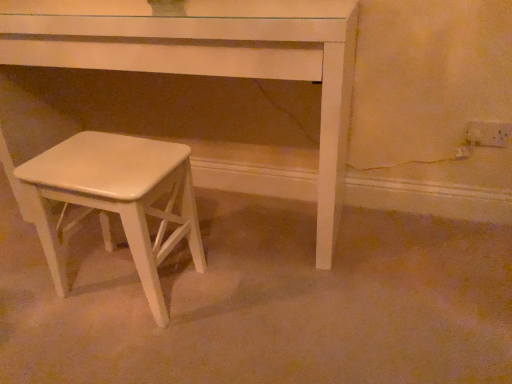
Question: In terms of height, does white wood stool at lower left look taller or shorter compared to white glossy stool at lower left?

Choices:
 (A) tall
 (B) short

Answer: (A)

Question: From a real-world perspective, is white wood stool at lower left physically located above or below white glossy stool at lower left?

Choices:
 (A) below
 (B) above

Answer: (B)

Question: In terms of width, does white wood stool at lower left look wider or thinner when compared to white glossy stool at lower left?

Choices:
 (A) wide
 (B) thin

Answer: (A)

Question: Considering the relative positions of white glossy stool at lower left and white wood stool at lower left in the image provided, is white glossy stool at lower left to the left or to the right of white wood stool at lower left?

Choices:
 (A) left
 (B) right

Answer: (A)

Question: From a real-world perspective, is white glossy stool at lower left positioned above or below white wood stool at lower left?

Choices:
 (A) below
 (B) above

Answer: (A)

Question: Is point (196, 268) closer or farther from the camera than point (309, 38)?

Choices:
 (A) closer
 (B) farther

Answer: (B)

Question: Looking at the image, does white glossy stool at lower left seem bigger or smaller compared to white wood stool at lower left?

Choices:
 (A) big
 (B) small

Answer: (B)